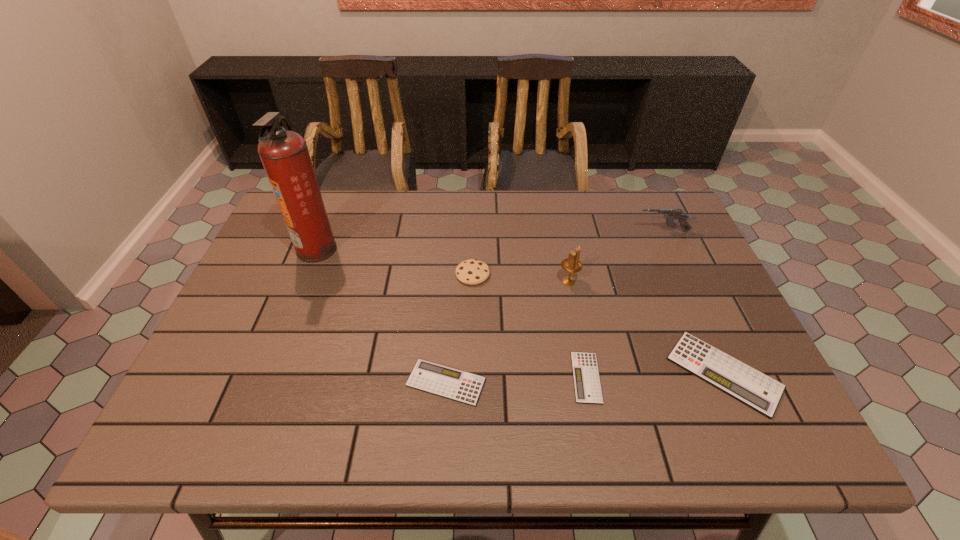
Please point out where to position a new calculator on the left to maintain spacing. Please provide its 2D coordinates. Your answer should be formatted as a tuple, i.e. [(x, y)], where the tuple contains the x and y coordinates of a point satisfying the conditions above.

[(303, 387)]